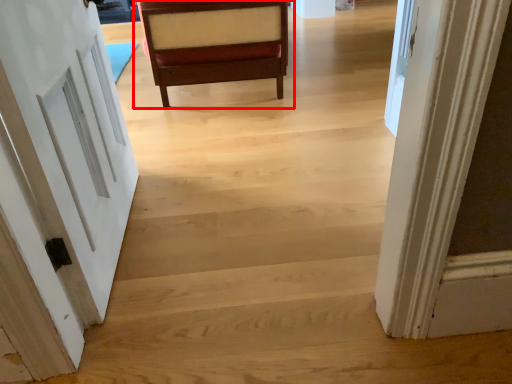
Question: From the image's perspective, what is the correct spatial relationship of chair (annotated by the red box) in relation to door?

Choices:
 (A) below
 (B) above

Answer: (B)